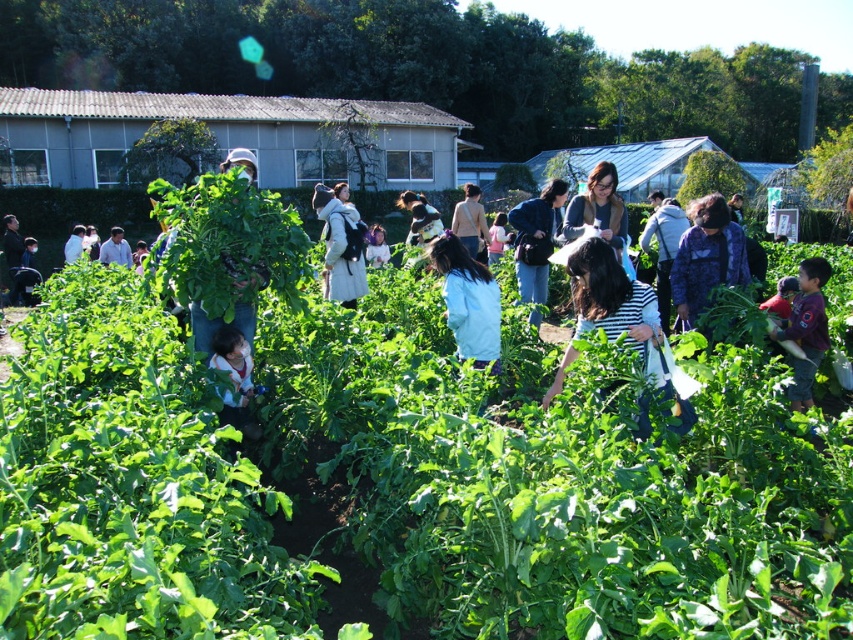
You are a photographer standing at the edge of the garden. You want to take a photo of the denim jacket at center and the matte green shirt at center. Which one will appear closer to you in the photo?

The denim jacket at center will appear closer to you in the photo because the matte green shirt at center is behind it.

What are the coordinates of the green leafy vegetables at center?

The green leafy vegetables at center are located at coordinates point (393, 468).

You are a visitor standing at the edge of the garden and want to take a photo of the green leafy vegetables at center and the matte green shirt at center. The camera you have can only focus on objects within 30 inches of each other. Can both objects be in focus at the same time?

The green leafy vegetables at center is 31.86 inches from matte green shirt at center. Since the distance between them is greater than 30 inches, the camera cannot focus on both objects simultaneously.